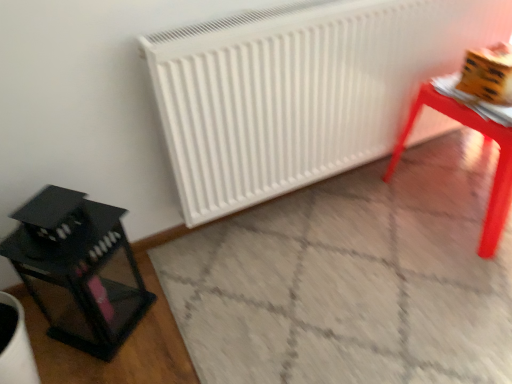
The width and height of the screenshot is (512, 384). I want to click on vacant space underneath black glass lantern at left (from a real-world perspective), so click(109, 314).